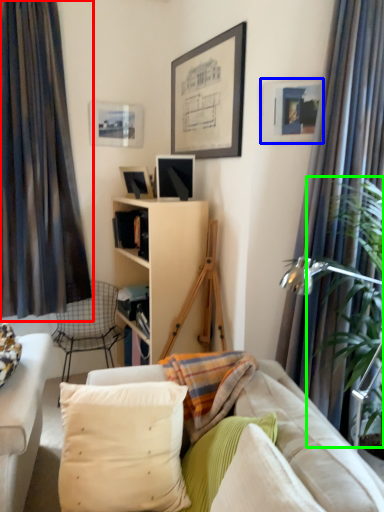
Question: Based on their relative distances, which object is nearer to curtain (highlighted by a red box)? Choose from picture frame (highlighted by a blue box) and plant (highlighted by a green box).

Choices:
 (A) picture frame
 (B) plant

Answer: (A)